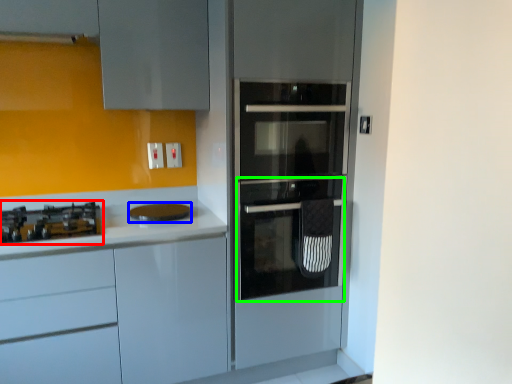
Question: Considering the real-world distances, which object is farthest from gas stove (highlighted by a red box)? home appliance (highlighted by a blue box) or oven (highlighted by a green box)?

Choices:
 (A) home appliance
 (B) oven

Answer: (B)